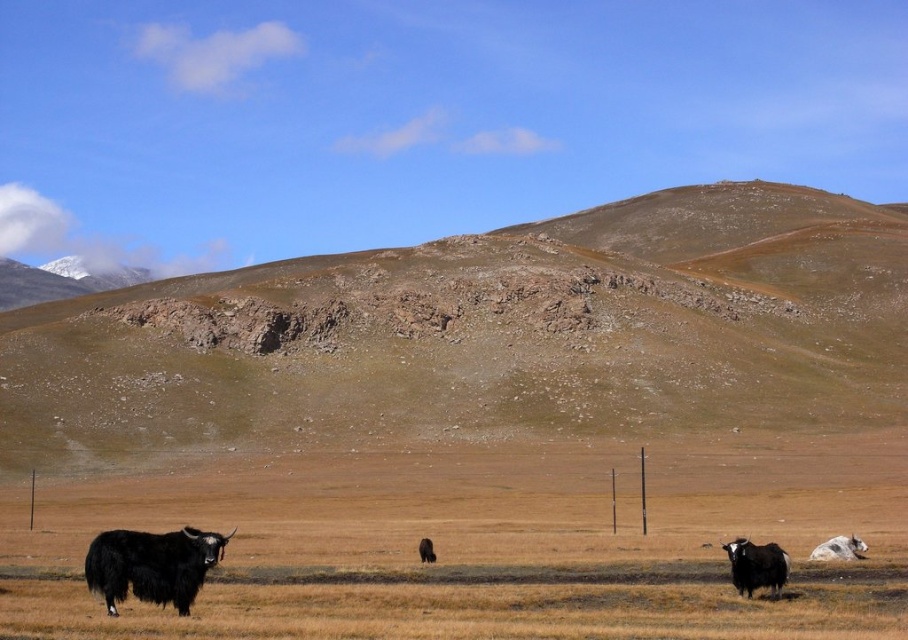
You are a photographer trying to capture the brown rocky mountain at center and the black fuzzy bison at lower right in a single frame. Based on their sizes, which one will appear larger in your photo?

The brown rocky mountain at center will appear larger in the photo because it is bigger than the black fuzzy bison at lower right.

You are standing at the point with coordinates point (487, 333). Looking around, you see a brown rocky mountain at center. Which direction should you face to see the brown rocky mountain at center?

You are already at the point (487, 333), which represents the brown rocky mountain at center. Therefore, you are standing at the mountain itself, so you cannot see it from any direction.

You are a hiker standing at the base of the brown rocky mountain at center and want to reach the black fuzzy bison at lower right. Which direction should you move to get closer to the bison?

The brown rocky mountain at center is positioned on the left side of the black fuzzy bison at lower right, so you should move to the right to get closer to the bison.